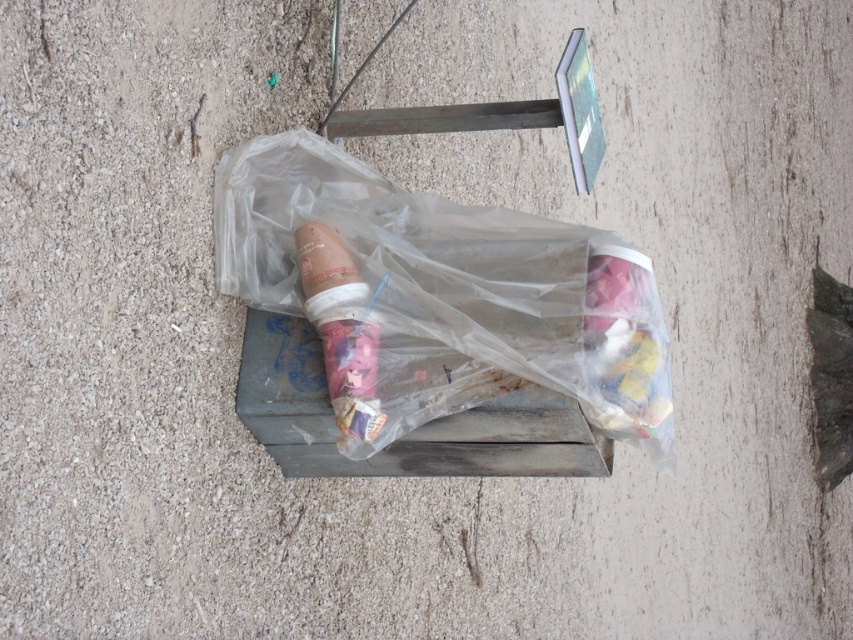
Is transparent plastic bag at center positioned before matte plastic ice cream cone at center?

Yes, it is.

Identify the location of transparent plastic bag at center. (440, 296).